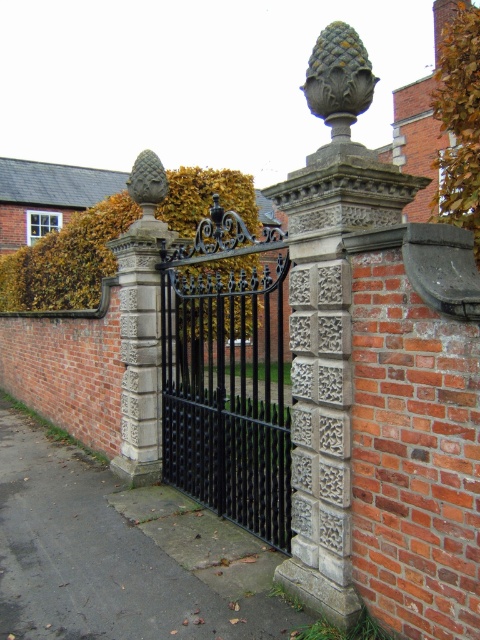
Question: Is black wrought iron gate at center to the right of matte gray acorn at center from the viewer's perspective?

Choices:
 (A) yes
 (B) no

Answer: (A)

Question: Among these objects, which one is nearest to the camera?

Choices:
 (A) stone textured acorn at center
 (B) matte gray acorn at center

Answer: (A)

Question: Which of the following is the closest to the observer?

Choices:
 (A) (160, 196)
 (B) (235, 244)
 (C) (323, 45)

Answer: (C)

Question: Is the position of black wrought iron gate at center less distant than that of matte gray acorn at center?

Choices:
 (A) no
 (B) yes

Answer: (B)

Question: Based on their relative distances, which object is farther from the matte gray acorn at center?

Choices:
 (A) black wrought iron gate at center
 (B) stone textured acorn at center

Answer: (A)

Question: From the image, what is the correct spatial relationship of black wrought iron gate at center in relation to matte gray acorn at center?

Choices:
 (A) left
 (B) right

Answer: (B)